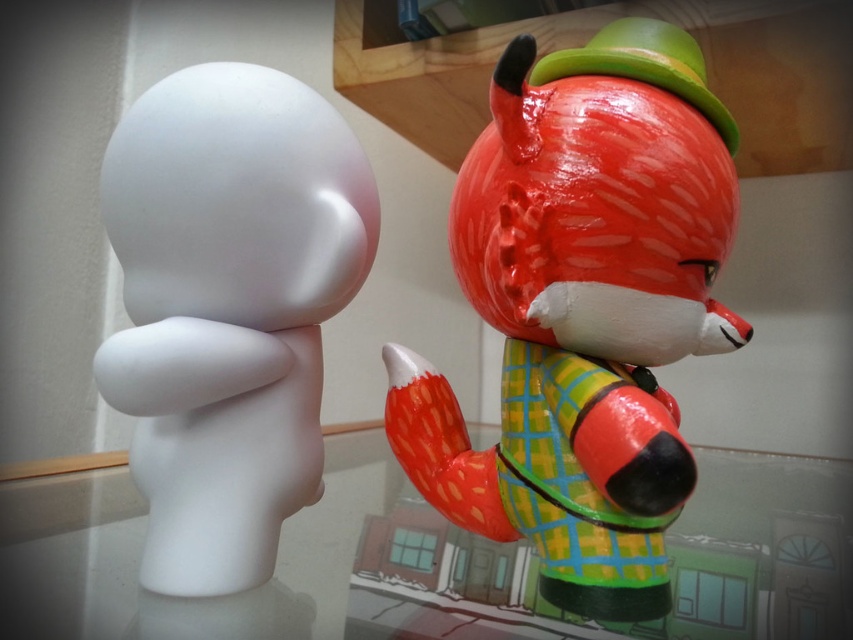
Question: Does shiny red fox at right appear over matte white figure at left?

Choices:
 (A) no
 (B) yes

Answer: (B)

Question: Which point appears farthest from the camera in this image?

Choices:
 (A) (613, 188)
 (B) (312, 156)

Answer: (B)

Question: Is shiny red fox at right below matte white figure at left?

Choices:
 (A) yes
 (B) no

Answer: (B)

Question: Does shiny red fox at right have a larger size compared to matte white figure at left?

Choices:
 (A) no
 (B) yes

Answer: (B)